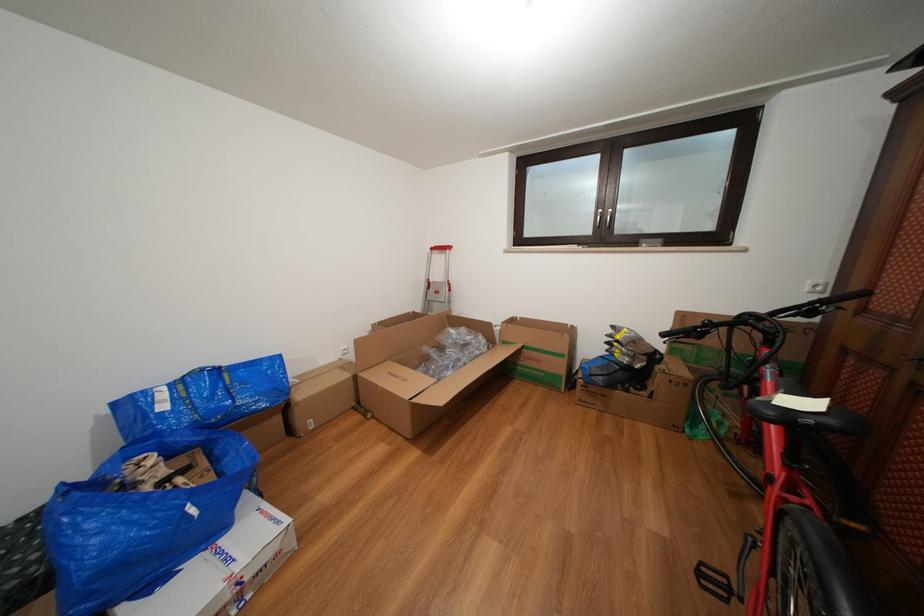
Find the location of a particular element. The width and height of the screenshot is (924, 616). black bicycle pedal is located at coordinates (713, 582).